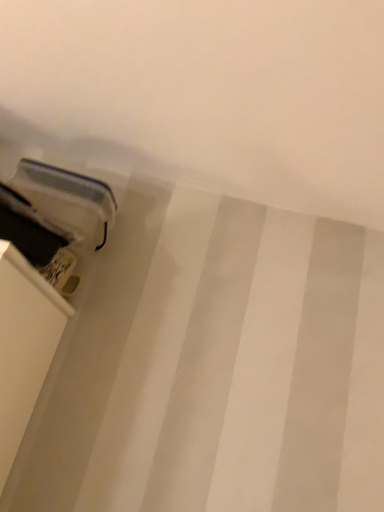
Question: Considering the positions of matte plastic container at lower left and matte plastic shelf at lower left in the image, is matte plastic container at lower left taller or shorter than matte plastic shelf at lower left?

Choices:
 (A) short
 (B) tall

Answer: (B)

Question: Would you say matte plastic container at lower left is inside or outside matte plastic shelf at lower left?

Choices:
 (A) inside
 (B) outside

Answer: (B)

Question: Considering the positions of matte plastic container at lower left and matte plastic shelf at lower left in the image, is matte plastic container at lower left bigger or smaller than matte plastic shelf at lower left?

Choices:
 (A) big
 (B) small

Answer: (A)

Question: From a real-world perspective, is matte plastic shelf at lower left physically located above or below matte plastic container at lower left?

Choices:
 (A) below
 (B) above

Answer: (A)

Question: From the image's perspective, is matte plastic shelf at lower left above or below matte plastic container at lower left?

Choices:
 (A) above
 (B) below

Answer: (B)

Question: From their relative heights in the image, would you say matte plastic shelf at lower left is taller or shorter than matte plastic container at lower left?

Choices:
 (A) short
 (B) tall

Answer: (A)

Question: Is matte plastic shelf at lower left bigger or smaller than matte plastic container at lower left?

Choices:
 (A) big
 (B) small

Answer: (B)